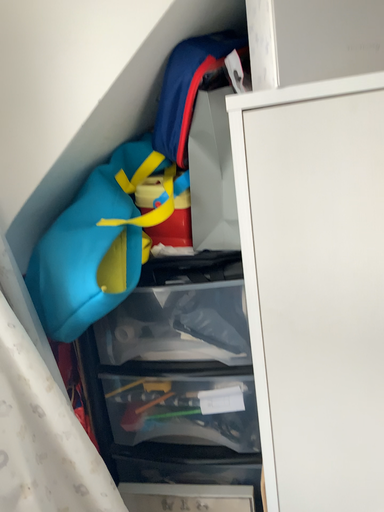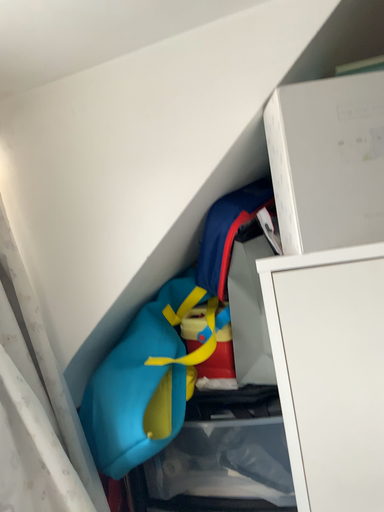
Question: How did the camera likely rotate when shooting the video?

Choices:
 (A) rotated upward
 (B) rotated downward

Answer: (A)